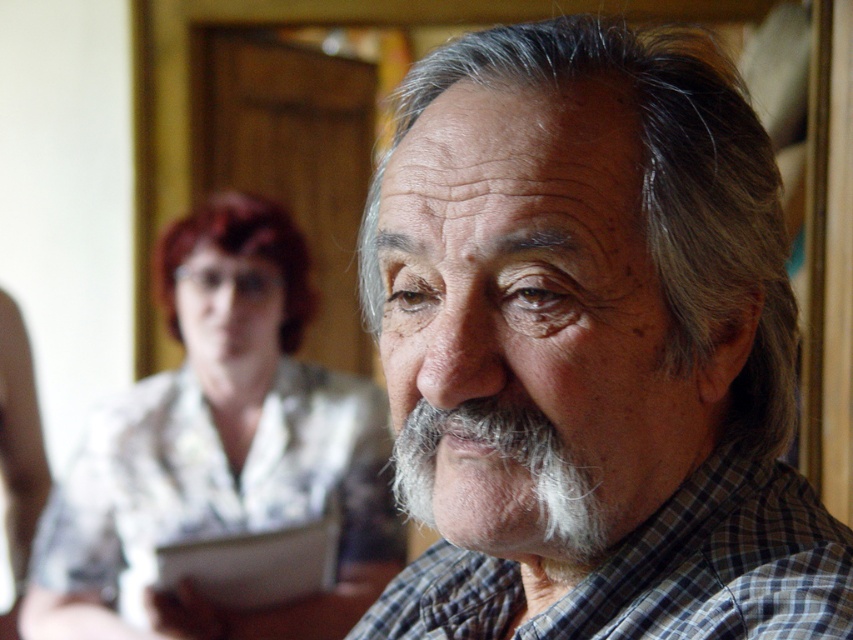
Question: Is gray matte hair at center bigger than checkered fabric shirt at center?

Choices:
 (A) yes
 (B) no

Answer: (A)

Question: Which point is closer to the camera?

Choices:
 (A) checkered fabric shirt at center
 (B) gray/soft hair at center
 (C) gray matte hair at center
 (D) white floral blouse at center

Answer: (A)

Question: Estimate the real-world distances between objects in this image. Which object is closer to the gray matte hair at center?

Choices:
 (A) gray/soft hair at center
 (B) dark red hair at upper left
 (C) white floral blouse at center

Answer: (A)

Question: Does white floral blouse at center appear on the left side of checkered fabric shirt at center?

Choices:
 (A) no
 (B) yes

Answer: (B)

Question: Is checkered fabric shirt at center above dark red hair at upper left?

Choices:
 (A) no
 (B) yes

Answer: (A)

Question: Which point is closer to the camera?

Choices:
 (A) gray matte hair at center
 (B) white floral blouse at center
 (C) checkered fabric shirt at center
 (D) dark red hair at upper left

Answer: (C)